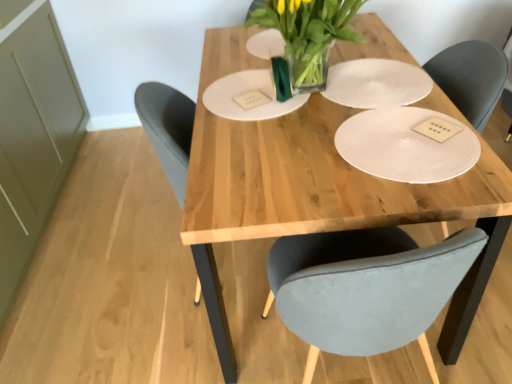
Question: From the image's perspective, relative to white textured paper plate at center, placed as the second paper plate when sorted from left to right, is natural wood table at center above or below?

Choices:
 (A) above
 (B) below

Answer: (B)

Question: Looking at the image, does natural wood table at center seem bigger or smaller compared to white textured paper plate at center, the first paper plate in the right-to-left sequence?

Choices:
 (A) small
 (B) big

Answer: (B)

Question: Estimate the real-world distances between objects in this image. Which object is closer to the white matte paper plate at center, which appears as the 2th paper plate when viewed from the right?

Choices:
 (A) translucent glass vase at center
 (B) white textured paper plate at center, placed as the second paper plate when sorted from left to right
 (C) white textured plate at center
 (D) natural wood table at center

Answer: (A)

Question: Based on their relative distances, which object is farther from the white textured plate at center?

Choices:
 (A) white matte paper plate at center, which appears as the 2th paper plate when viewed from the right
 (B) natural wood table at center
 (C) translucent glass vase at center
 (D) white textured paper plate at center, the first paper plate in the right-to-left sequence

Answer: (A)